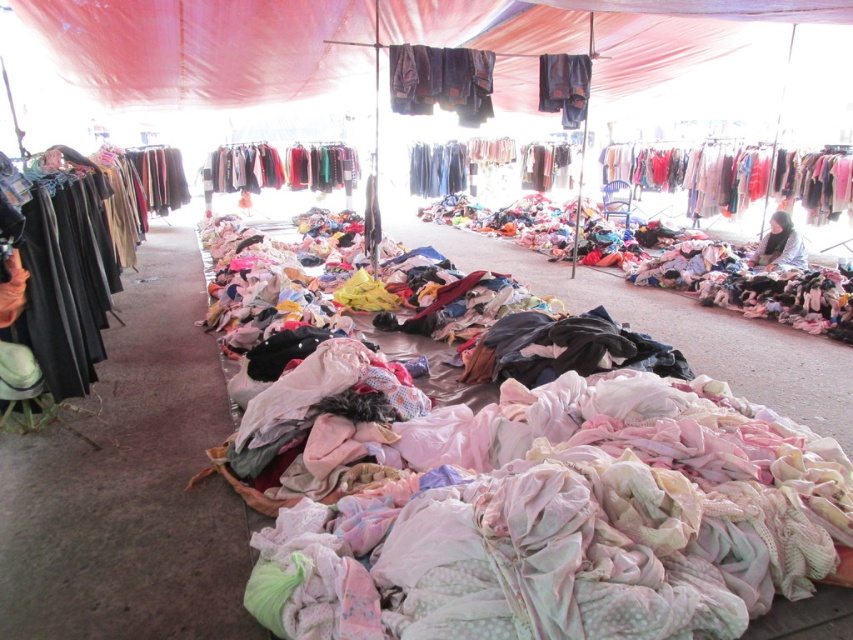
Which is in front, point (708, 212) or point (532, 186)?

Point (708, 212) is more forward.

Which is below, pastel cotton shirts at right or light pink fabric pants at center?

pastel cotton shirts at right

Is point (839, 211) closer to viewer compared to point (544, 177)?

That is True.

Identify the location of pastel cotton shirts at right. The height and width of the screenshot is (640, 853). (735, 177).

Can you confirm if matte red fabric canopy at upper center is positioned below dark blue jeans at center?

No, matte red fabric canopy at upper center is not below dark blue jeans at center.

Between matte red fabric canopy at upper center and dark blue jeans at center, which one appears on the right side from the viewer's perspective?

matte red fabric canopy at upper center

Who is more distant from viewer, (99, 38) or (560, 60)?

The point (560, 60) is behind.

Where is `matte red fabric canopy at upper center`? The width and height of the screenshot is (853, 640). matte red fabric canopy at upper center is located at coordinates (202, 48).

Is matte black pants at left smaller than white cotton shirt at center?

Actually, matte black pants at left might be larger than white cotton shirt at center.

Who is lower down, matte black pants at left or white cotton shirt at center?

matte black pants at left is lower down.

Between point (38, 179) and point (781, 250), which one is positioned behind?

Positioned behind is point (781, 250).

Locate an element on the screen. Image resolution: width=853 pixels, height=640 pixels. matte black pants at left is located at coordinates (71, 272).